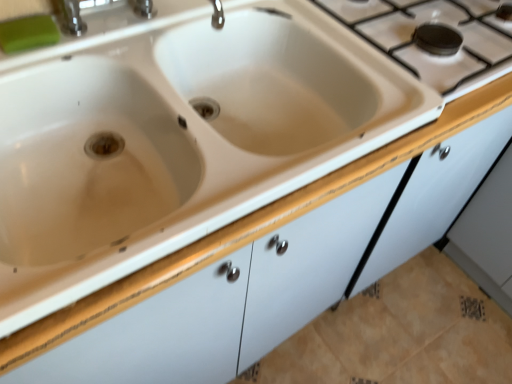
Question: From a real-world perspective, is white ceramic sink at center physically located above or below white ceramic gas stove at upper right?

Choices:
 (A) below
 (B) above

Answer: (A)

Question: In terms of size, does white ceramic sink at center appear bigger or smaller than white ceramic gas stove at upper right?

Choices:
 (A) big
 (B) small

Answer: (A)

Question: Considering the real-world distances, which object is closest to the white ceramic sink at center?

Choices:
 (A) white ceramic gas stove at upper right
 (B) green rubber soap at upper left

Answer: (B)

Question: Considering the real-world distances, which object is farthest from the white ceramic gas stove at upper right?

Choices:
 (A) white ceramic sink at center
 (B) green rubber soap at upper left

Answer: (B)